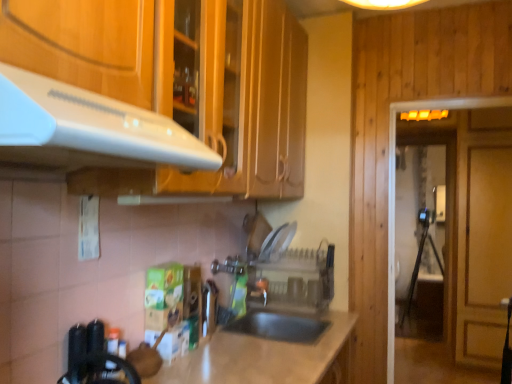
The image size is (512, 384). Describe the element at coordinates (262, 288) in the screenshot. I see `metallic silver faucet at center` at that location.

The height and width of the screenshot is (384, 512). In order to click on metallic silver faucet at center in this screenshot , I will do `click(262, 288)`.

Describe the element at coordinates (88, 129) in the screenshot. The width and height of the screenshot is (512, 384). I see `white glossy exhaust hood at upper left` at that location.

What do you see at coordinates (296, 280) in the screenshot? I see `clear plastic dish rack at center` at bounding box center [296, 280].

At what (x,y) coordinates should I click in order to perform the action: click on clear plastic dish rack at center. Please return your answer as a coordinate pair (x, y). Looking at the image, I should click on (296, 280).

What are the coordinates of `transparent glass door at right, the first glass door in the back-to-front sequence` in the screenshot? It's located at (426, 165).

In order to face transparent glass door at right, the second glass door in the back-to-front sequence, should I rotate leftwards or rightwards?

A 25.008 degree turn to the right will do.

Find the location of a particular element. The width and height of the screenshot is (512, 384). metallic silver faucet at center is located at coordinates (262, 288).

From the image's perspective, is white glossy exhaust hood at upper left above transparent glass door at right, which ranks as the 1th glass door in right-to-left order?

Correct, white glossy exhaust hood at upper left appears higher than transparent glass door at right, which ranks as the 1th glass door in right-to-left order, in the image.

Which is in front, point (2, 153) or point (420, 172)?

The point (2, 153) is in front.

At what (x,y) coordinates should I click in order to perform the action: click on glass door that is the 2nd object to the right of the white glossy exhaust hood at upper left, starting at the anchor. Please return your answer as a coordinate pair (x, y). The width and height of the screenshot is (512, 384). Looking at the image, I should click on (426, 165).

Between white glossy exhaust hood at upper left and transparent glass door at right, the second glass door positioned from the left, which one appears on the left side from the viewer's perspective?

white glossy exhaust hood at upper left is more to the left.

In the scene shown: Is clear plastic dish rack at center located outside white glossy exhaust hood at upper left?

Yes.

Is clear plastic dish rack at center oriented towards white glossy exhaust hood at upper left?

Yes, clear plastic dish rack at center is oriented towards white glossy exhaust hood at upper left.

Between point (305, 263) and point (82, 134), which one is positioned behind?

The point (305, 263) is farther.

From the image's perspective, is clear plastic dish rack at center beneath white glossy exhaust hood at upper left?

Yes, from the image's perspective, clear plastic dish rack at center is below white glossy exhaust hood at upper left.

From the image's perspective, is clear plastic dish rack at center on top of transparent glass door at right, the second glass door positioned from the left?

Yes, from the image's perspective, clear plastic dish rack at center is over transparent glass door at right, the second glass door positioned from the left.

In the scene shown: Which point is more distant from viewer, (267, 296) or (452, 172)?

The point (452, 172) is behind.

From the picture: From a real-world perspective, who is located lower, clear plastic dish rack at center or transparent glass door at right, the first glass door in the back-to-front sequence?

Result: From a 3D spatial view, clear plastic dish rack at center is below.

How different are the orientations of metallic silver faucet at center and clear plastic dish rack at center in degrees?

They differ by 87.4 degrees in their facing directions.

Looking at this image, who is smaller, metallic silver faucet at center or clear plastic dish rack at center?

metallic silver faucet at center.

Which is closer to the camera, [263,282] or [325,308]?

Point [263,282] is farther from the camera than point [325,308].

Is metallic silver faucet at center inside the boundaries of clear plastic dish rack at center, or outside?

metallic silver faucet at center is located inside clear plastic dish rack at center.

Which of these two, transparent glass door at right, the first glass door in the back-to-front sequence, or transparent glass door at right, which is the second glass door from right to left, is wider?

Wider between the two is transparent glass door at right, the first glass door in the back-to-front sequence.

Is transparent glass door at right, the first glass door from the left, surrounded by transparent glass door at right, the first glass door in the back-to-front sequence?

No, transparent glass door at right, the first glass door from the left, is located outside of transparent glass door at right, the first glass door in the back-to-front sequence.

Is transparent glass door at right, the first glass door in the back-to-front sequence, far away from transparent glass door at right, the second glass door in the back-to-front sequence?

Indeed, transparent glass door at right, the first glass door in the back-to-front sequence, is not near transparent glass door at right, the second glass door in the back-to-front sequence.

Between transparent glass door at right, the first glass door in the back-to-front sequence, and transparent glass door at right, the second glass door in the back-to-front sequence, which one appears on the right side from the viewer's perspective?

transparent glass door at right, the first glass door in the back-to-front sequence.

Is white glossy exhaust hood at upper left not close to transparent glass door at right, the second glass door in the back-to-front sequence?

Indeed, white glossy exhaust hood at upper left is not near transparent glass door at right, the second glass door in the back-to-front sequence.

Measure the distance between white glossy exhaust hood at upper left and transparent glass door at right, which is the second glass door from right to left.

white glossy exhaust hood at upper left and transparent glass door at right, which is the second glass door from right to left, are 1.78 meters apart.

Which is in front, point (102, 100) or point (391, 323)?

The point (102, 100) is in front.

From the picture: From the image's perspective, is white glossy exhaust hood at upper left on top of transparent glass door at right, the first glass door from the front?

Correct, white glossy exhaust hood at upper left appears higher than transparent glass door at right, the first glass door from the front, in the image.

Which is in front, metallic silver faucet at center or transparent glass door at right, the first glass door in the back-to-front sequence?

metallic silver faucet at center is in front.

Can you confirm if metallic silver faucet at center is wider than transparent glass door at right, arranged as the second glass door when viewed from the front?

No.

Does point (267, 279) come in front of point (405, 141)?

That is True.

This screenshot has height=384, width=512. Identify the location of the 2nd glass door behind the white glossy exhaust hood at upper left. (426, 165).

Identify the location of appliance that is below the white glossy exhaust hood at upper left (from the image's perspective). (296, 280).

Based on the photo, based on their spatial positions, is transparent glass door at right, the first glass door in the back-to-front sequence, or white glossy exhaust hood at upper left further from transparent glass door at right, the second glass door in the back-to-front sequence?

transparent glass door at right, the first glass door in the back-to-front sequence, is positioned further to the anchor transparent glass door at right, the second glass door in the back-to-front sequence.

When comparing their distances from transparent glass door at right, which is the second glass door from right to left, does metallic silver faucet at center or transparent glass door at right, arranged as the second glass door when viewed from the front, seem closer?

metallic silver faucet at center lies closer to transparent glass door at right, which is the second glass door from right to left, than the other object.

When comparing their distances from white glossy exhaust hood at upper left, does transparent glass door at right, the first glass door from the left, or clear plastic dish rack at center seem closer?

Based on the image, clear plastic dish rack at center appears to be nearer to white glossy exhaust hood at upper left.

Estimate the real-world distances between objects in this image. Which object is closer to transparent glass door at right, the first glass door from the front, clear plastic dish rack at center or white glossy exhaust hood at upper left?

The object closer to transparent glass door at right, the first glass door from the front, is clear plastic dish rack at center.

Based on their spatial positions, is white glossy exhaust hood at upper left or transparent glass door at right, the first glass door from the left, further from transparent glass door at right, the first glass door in the back-to-front sequence?

Based on the image, white glossy exhaust hood at upper left appears to be further to transparent glass door at right, the first glass door in the back-to-front sequence.

When comparing their distances from clear plastic dish rack at center, does transparent glass door at right, the first glass door from the front, or transparent glass door at right, the second glass door positioned from the left, seem further?

transparent glass door at right, the second glass door positioned from the left.

From the image, which object appears to be nearer to clear plastic dish rack at center, white glossy exhaust hood at upper left or transparent glass door at right, the first glass door from the left?

Among the two, transparent glass door at right, the first glass door from the left, is located nearer to clear plastic dish rack at center.

Consider the image. Considering their positions, is white glossy exhaust hood at upper left positioned further to metallic silver faucet at center than transparent glass door at right, arranged as the second glass door when viewed from the front?

The object further to metallic silver faucet at center is transparent glass door at right, arranged as the second glass door when viewed from the front.

Where is `appliance between white glossy exhaust hood at upper left and transparent glass door at right, the first glass door from the left, from front to back`? This screenshot has width=512, height=384. appliance between white glossy exhaust hood at upper left and transparent glass door at right, the first glass door from the left, from front to back is located at coordinates (296, 280).

Locate an element on the screen. The image size is (512, 384). faucet between white glossy exhaust hood at upper left and transparent glass door at right, the second glass door positioned from the left, along the z-axis is located at coordinates (262, 288).

The width and height of the screenshot is (512, 384). I want to click on appliance between metallic silver faucet at center and transparent glass door at right, the first glass door from the front, so click(x=296, y=280).

The height and width of the screenshot is (384, 512). In order to click on appliance positioned between white glossy exhaust hood at upper left and metallic silver faucet at center from near to far in this screenshot , I will do `click(296, 280)`.